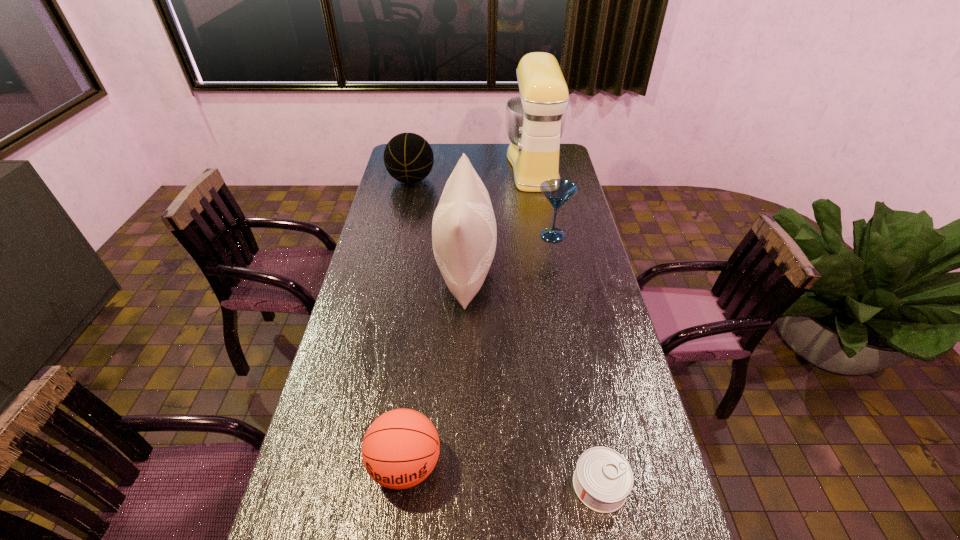
Where is `blank region between the fifth tallest object and the tallest object`? blank region between the fifth tallest object and the tallest object is located at coordinates (469, 316).

Select which object is the fourth closest to the martini. Please provide its 2D coordinates. Your answer should be formatted as a tuple, i.e. [(x, y)], where the tuple contains the x and y coordinates of a point satisfying the conditions above.

[(400, 449)]

Identify which object is the closest to the cushion. Please provide its 2D coordinates. Your answer should be formatted as a tuple, i.e. [(x, y)], where the tuple contains the x and y coordinates of a point satisfying the conditions above.

[(557, 191)]

Find the location of a particular element. This screenshot has height=540, width=960. vacant space that satisfies the following two spatial constraints: 1. on the side of the martini with the control knob; 2. on the left side of the tallest object is located at coordinates (546, 235).

Find the location of a particular element. The width and height of the screenshot is (960, 540). vacant space that satisfies the following two spatial constraints: 1. on the back side of the shortest object; 2. on the side of the tallest object with the control knob is located at coordinates pyautogui.click(x=539, y=166).

Identify the location of vacant space that satisfies the following two spatial constraints: 1. on the front side of the fifth shortest object; 2. on the side with logo of the nearer basketball. The image size is (960, 540). (460, 465).

This screenshot has width=960, height=540. I want to click on free space in the image that satisfies the following two spatial constraints: 1. on the side of the mixer with the control knob; 2. on the right side of the can, so click(x=591, y=485).